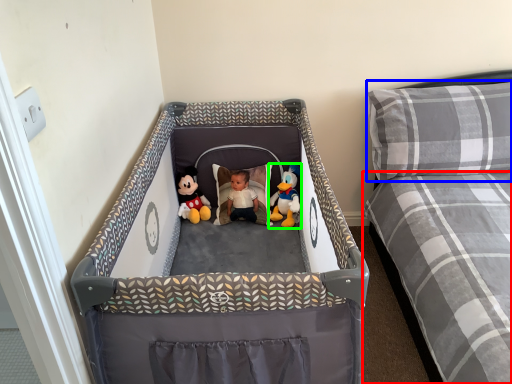
Question: Estimate the real-world distances between objects in this image. Which object is closer to mattress (highlighted by a red box), pillow (highlighted by a blue box) or toy (highlighted by a green box)?

Choices:
 (A) pillow
 (B) toy

Answer: (A)